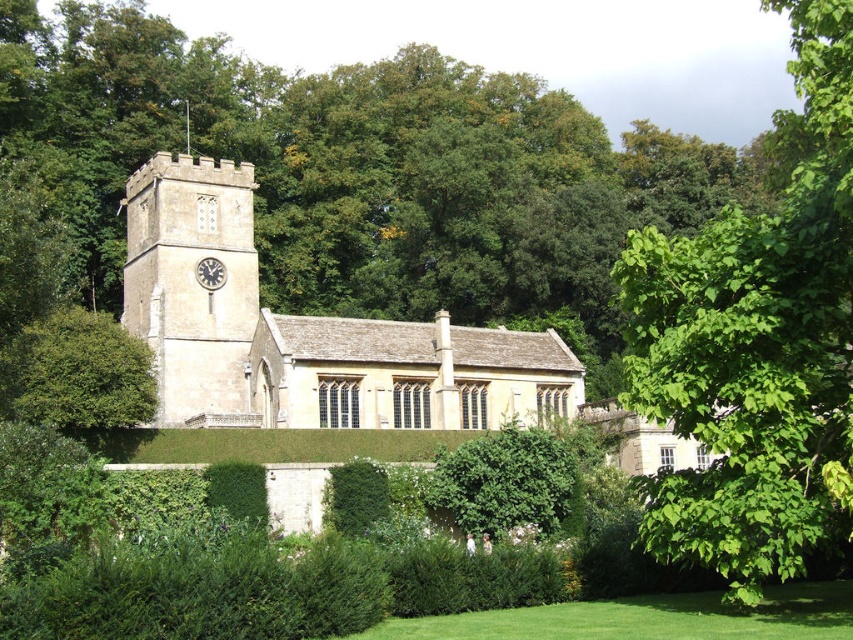
Question: Which object appears closest to the camera in this image?

Choices:
 (A) stone clock tower at left
 (B) matte stone clock at upper left
 (C) green grass lawn at lower center
 (D) beige stone church at center

Answer: (C)

Question: Which of the following is the closest to the observer?

Choices:
 (A) beige stone church at center
 (B) green grass lawn at lower center

Answer: (B)

Question: Is green leafy bush at center above matte stone clock at upper left?

Choices:
 (A) no
 (B) yes

Answer: (A)

Question: Is the position of green leafy tree at center less distant than that of beige stone church at center?

Choices:
 (A) yes
 (B) no

Answer: (A)

Question: Which of the following is the closest to the observer?

Choices:
 (A) matte stone clock at upper left
 (B) green grass lawn at lower center

Answer: (B)

Question: Is green leafy bush at left bigger than green leafy bush at center?

Choices:
 (A) yes
 (B) no

Answer: (A)